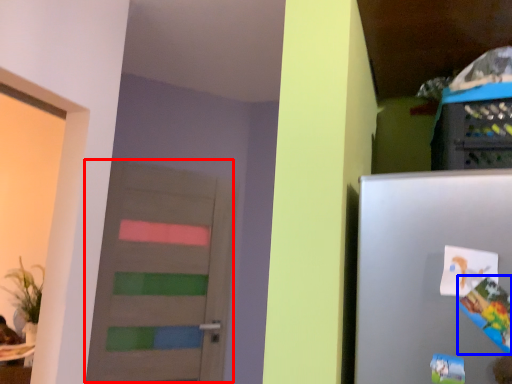
Question: Which point is further to the camera, door (highlighted by a red box) or comic book (highlighted by a blue box)?

Choices:
 (A) door
 (B) comic book

Answer: (A)